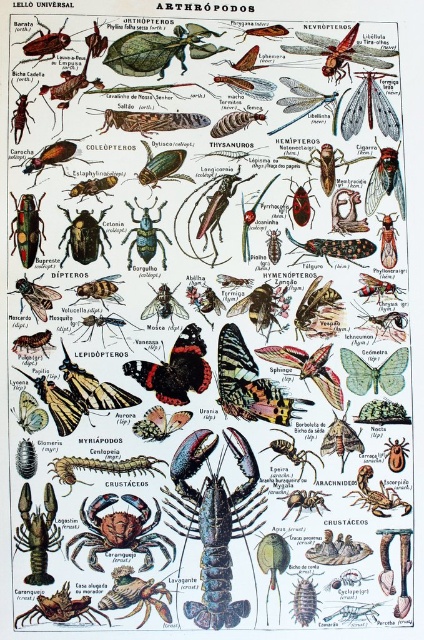
You are a student comparing the sizes of the translucent blue lobster at center and the matte black beetle at center in the LELLO UNIVERSAL ARTHR?PODOS illustration. Which one has a greater width?

The translucent blue lobster at center has a greater width than the matte black beetle at center according to the illustration.